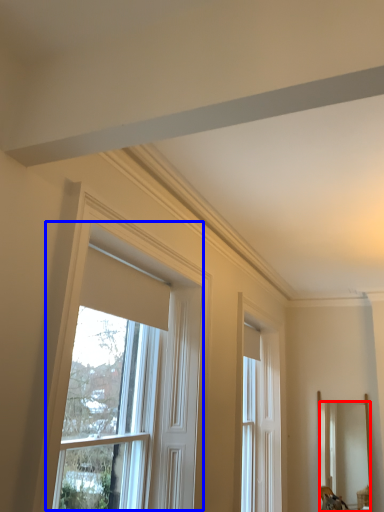
Question: Which of the following is the closest to the observer, mirror (highlighted by a red box) or window (highlighted by a blue box)?

Choices:
 (A) mirror
 (B) window

Answer: (B)